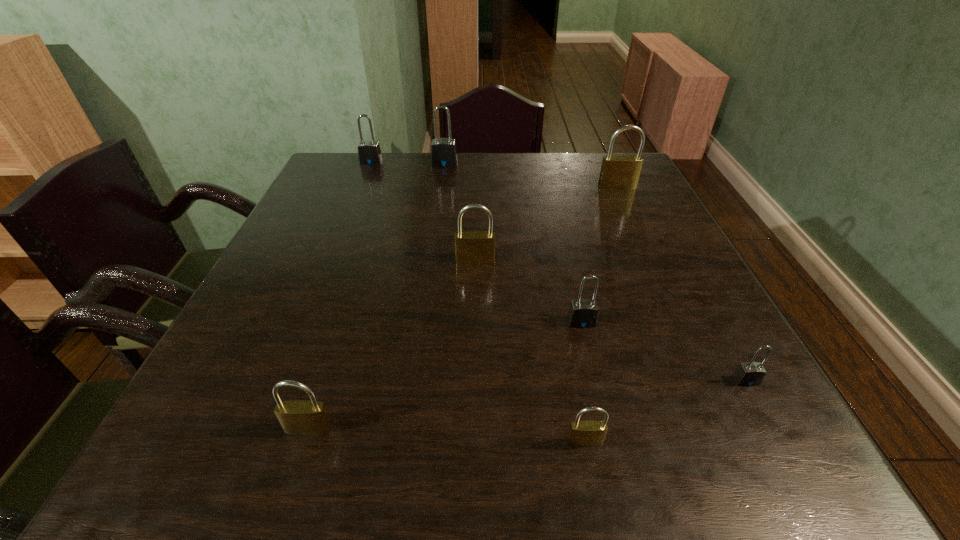
Identify which object is the seventh closest to the nearest brass padlock. Please provide its 2D coordinates. Your answer should be formatted as a tuple, i.e. [(x, y)], where the tuple contains the x and y coordinates of a point satisfying the conditions above.

[(369, 153)]

Select which padlock appears as the fourth closest to the seventh padlock from right to left. Please provide its 2D coordinates. Your answer should be formatted as a tuple, i.e. [(x, y)], where the tuple contains the x and y coordinates of a point satisfying the conditions above.

[(751, 373)]

Select which padlock appears as the seventh closest to the rightmost gray padlock. Please provide its 2D coordinates. Your answer should be formatted as a tuple, i.e. [(x, y)], where the tuple contains the x and y coordinates of a point satisfying the conditions above.

[(369, 153)]

In order to click on gray padlock that is the third closest one to the fifth farthest padlock in this screenshot , I will do `click(369, 153)`.

Point out which gray padlock is positioned as the second nearest to the leftmost padlock. Please provide its 2D coordinates. Your answer should be formatted as a tuple, i.e. [(x, y)], where the tuple contains the x and y coordinates of a point satisfying the conditions above.

[(583, 313)]

Select which brass padlock appears as the third closest to the seventh object from right to left. Please provide its 2D coordinates. Your answer should be formatted as a tuple, i.e. [(x, y)], where the tuple contains the x and y coordinates of a point satisfying the conditions above.

[(618, 172)]

Identify which brass padlock is the second closest to the fourth object from left to right. Please provide its 2D coordinates. Your answer should be formatted as a tuple, i.e. [(x, y)], where the tuple contains the x and y coordinates of a point satisfying the conditions above.

[(301, 417)]